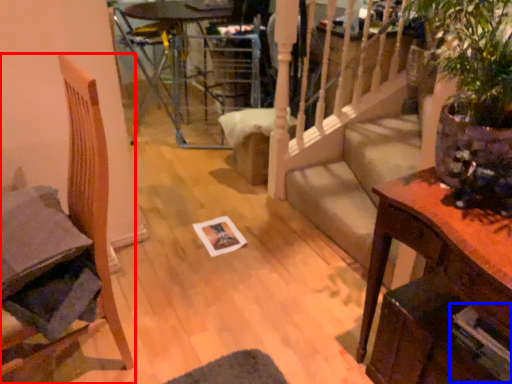
Question: Which of the following is the closest to the observer, chair (highlighted by a red box) or magazine (highlighted by a blue box)?

Choices:
 (A) chair
 (B) magazine

Answer: (A)